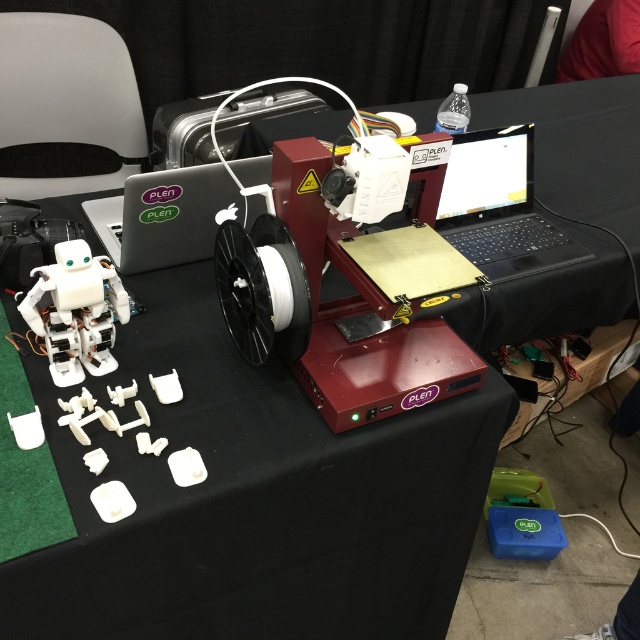
Based on the photo, you need to connect two laptops using a USB cable that is 60 centimeters long. The matte black laptop at upper right and the satin black laptop at center are both on the table. Can the USB cable reach between them?

The matte black laptop at upper right is 70.21 centimeters away from the satin black laptop at center. Since the USB cable is only 60 centimeters long, it cannot reach the distance between them.

You are a technician at the exhibition and need to access both the satin black laptop at center and the white plastic robot at lower left. Which object is closer to you when standing directly in front of the table?

The white plastic robot at lower left is closer because the satin black laptop at center is positioned over it, meaning the laptop is further away from you than the robot.